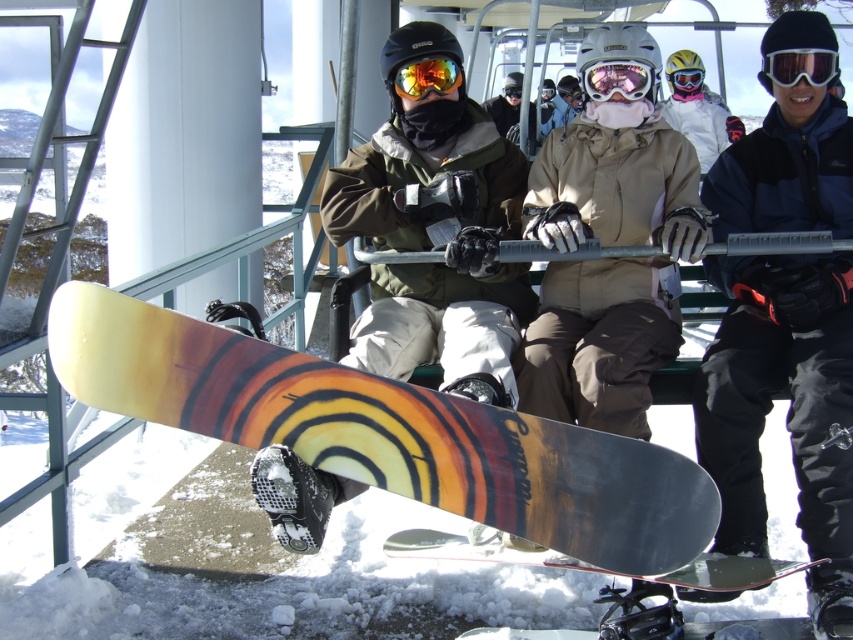
In the scene shown: How far apart are matte yellow snowboard at center and wooden snowboard at center?

matte yellow snowboard at center is 1.21 meters away from wooden snowboard at center.

Is matte yellow snowboard at center to the left of wooden snowboard at center from the viewer's perspective?

Correct, you'll find matte yellow snowboard at center to the left of wooden snowboard at center.

Locate an element on the screen. This screenshot has height=640, width=853. matte yellow snowboard at center is located at coordinates (431, 244).

Is point (698, 200) closer to viewer compared to point (688, 80)?

Yes.

Which is in front, point (492, 262) or point (677, 90)?

Point (492, 262) is more forward.

Between point (610, 420) and point (683, 72), which one is positioned in front?

Point (610, 420)

Where is `matte black snowboard at center`? Image resolution: width=853 pixels, height=640 pixels. matte black snowboard at center is located at coordinates (593, 365).

Measure the distance from yellow matte snowboard at center to matte yellow goggles at center.

yellow matte snowboard at center is 9.77 meters from matte yellow goggles at center.

Consider the image. Does yellow matte snowboard at center lie in front of matte yellow goggles at center?

Yes, yellow matte snowboard at center is closer to the viewer.

Is point (589, 550) farther from camera compared to point (672, 88)?

That is False.

Identify the location of yellow matte snowboard at center. (387, 433).